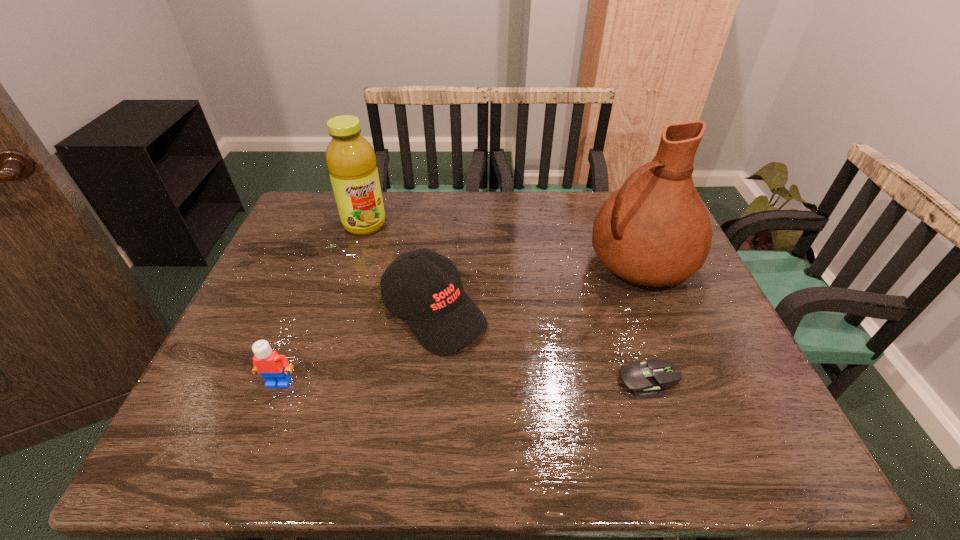
In order to click on Lego in this screenshot , I will do [x=273, y=367].

The height and width of the screenshot is (540, 960). In order to click on the shortest object in this screenshot , I will do `click(647, 380)`.

Find the location of a particular element. The image size is (960, 540). fruit juice is located at coordinates (351, 162).

Where is `baseball cap`? This screenshot has height=540, width=960. baseball cap is located at coordinates (443, 318).

Image resolution: width=960 pixels, height=540 pixels. What are the coordinates of `pitcher` in the screenshot? It's located at (655, 230).

At what (x,y) coordinates should I click in order to perform the action: click on blank area located on the back of the shortest object. Please return your answer as a coordinate pair (x, y). Image resolution: width=960 pixels, height=540 pixels. Looking at the image, I should click on (634, 336).

Locate an element on the screen. The image size is (960, 540). free space located 0.280m on the front label of the fruit juice is located at coordinates (398, 295).

This screenshot has width=960, height=540. In order to click on free space located 0.290m on the front label of the fruit juice in this screenshot , I will do `click(399, 298)`.

Where is `vacant space located on the front label of the fruit juice`? The width and height of the screenshot is (960, 540). vacant space located on the front label of the fruit juice is located at coordinates (383, 264).

Identify the location of free space located on the front-facing side of the third object from left to right. (546, 408).